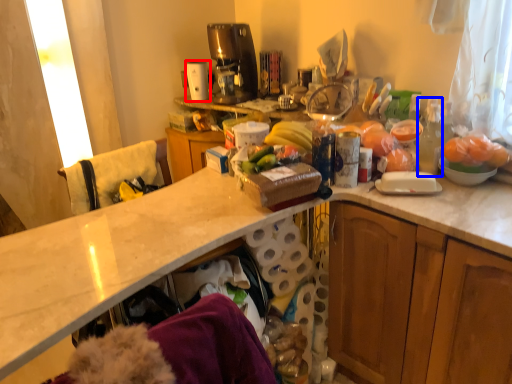
Question: Among these objects, which one is farthest to the camera, appliance (highlighted by a red box) or bottle (highlighted by a blue box)?

Choices:
 (A) appliance
 (B) bottle

Answer: (A)